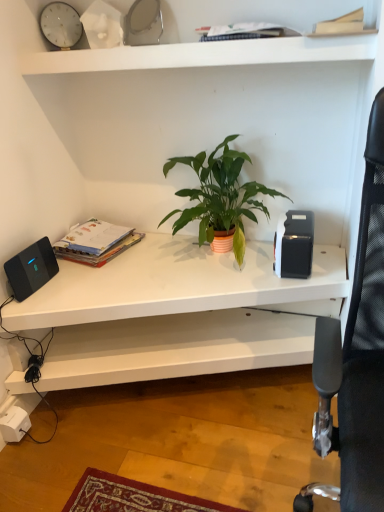
This screenshot has height=512, width=384. I want to click on free spot to the left of black plastic toaster at right, so click(233, 265).